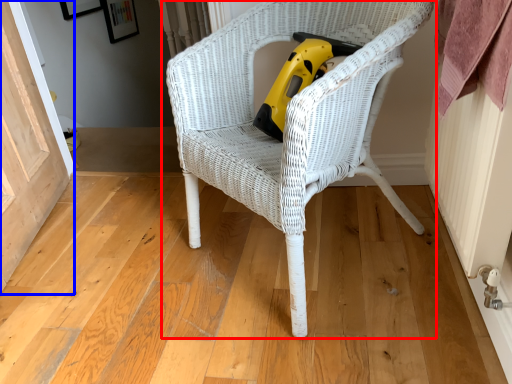
Question: Which of the following is the farthest to the observer, chair (highlighted by a red box) or screen door (highlighted by a blue box)?

Choices:
 (A) chair
 (B) screen door

Answer: (B)